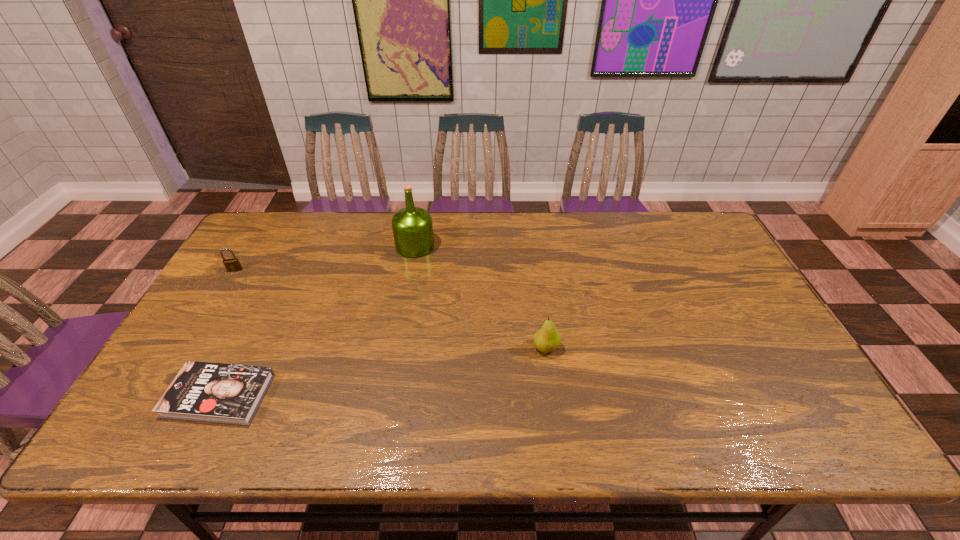
Where is `vacant region located on the back of the leftmost object`? The width and height of the screenshot is (960, 540). vacant region located on the back of the leftmost object is located at coordinates (x=269, y=215).

This screenshot has width=960, height=540. In order to click on vacant space located on the right of the shortest object in this screenshot , I will do `click(355, 395)`.

Locate an element on the screen. object that is at the far edge is located at coordinates (412, 226).

What are the coordinates of `object located in the near edge section of the desktop` in the screenshot? It's located at (209, 392).

The height and width of the screenshot is (540, 960). I want to click on padlock at the left edge, so click(x=232, y=265).

The image size is (960, 540). In order to click on book positioned at the left edge in this screenshot , I will do `click(209, 392)`.

This screenshot has width=960, height=540. I want to click on object located at the near left corner, so click(x=209, y=392).

The image size is (960, 540). I want to click on vacant space at the far edge of the desktop, so click(x=621, y=251).

This screenshot has width=960, height=540. I want to click on vacant position at the near edge of the desktop, so click(227, 446).

In the image, there is a desktop. Where is `free region at the left edge`? free region at the left edge is located at coordinates (194, 356).